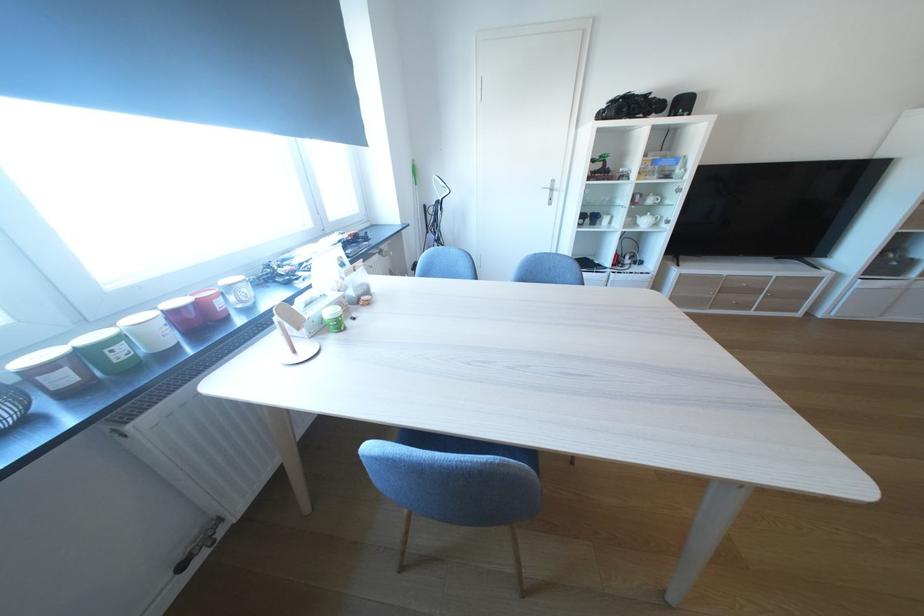
Which object does [309,312] point to?

This point indicates the white tissue box.